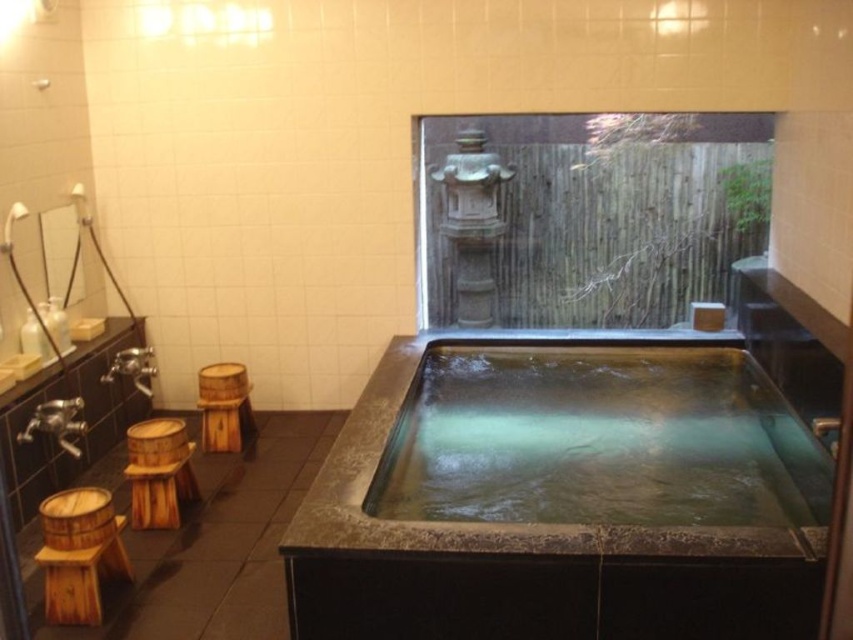
You are designing a layout for a traditional Japanese bathroom and must place a new decorative item between the wooden stool at lower left and the wooden at left. Which object should the item be placed closer to if it needs to occupy less space?

The item should be placed closer to the wooden at left because the wooden stool at lower left is wider than the wooden at left, so placing it near the narrower wooden at left would require less space.

From the picture: You are a guest at the ryokan and want to take a bath. The smooth stone bath at center is your destination. However, there is a wooden barrel stool at lower left blocking your path. Can you walk around it to reach the bath?

The smooth stone bath at center is in front of the wooden barrel stool at lower left, meaning the stool is between you and the bath. To reach the bath, you would need to navigate around the stool since it is blocking your direct path.